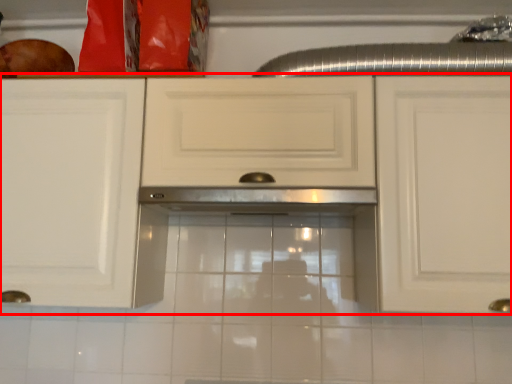
Question: From the image, what is the correct spatial relationship of cabinetry (annotated by the red box) in relation to exhaust hood?

Choices:
 (A) left
 (B) right

Answer: (A)